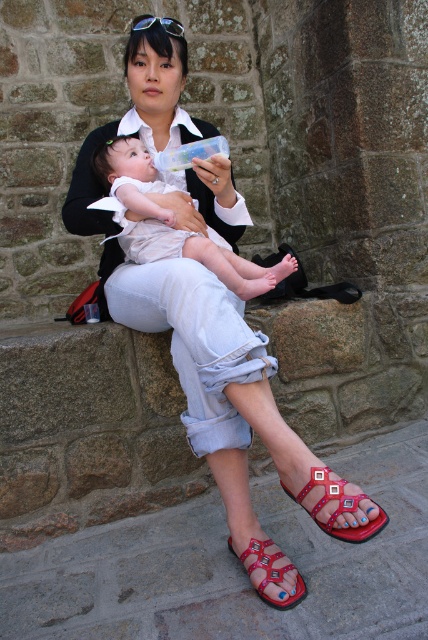
You are a fashion designer trying to create a matching outfit for the woman in the image. Given that the matte black shirt at center and the red leather sandal at lower center are part of her current outfit, which item should you consider adjusting in size to ensure a proportional look?

Since the matte black shirt at center is wider than the red leather sandal at lower center, you should consider adjusting the size of the red leather sandal at lower center to match the proportion of the wider matte black shirt at center for a balanced look.

Consider the image. You are standing at a point 5.25 feet away from the point at coordinates point (190, 179). If you want to move closer to that point, which direction should you move?

Since you are 5.25 feet away from the point (190, 179), you should move forward towards the point to get closer.

Based on the scene described, where is the red leather sandal at lower center in relation to the shiny black sunglasses at upper center?

The red leather sandal at lower center is to the right of the shiny black sunglasses at upper center.